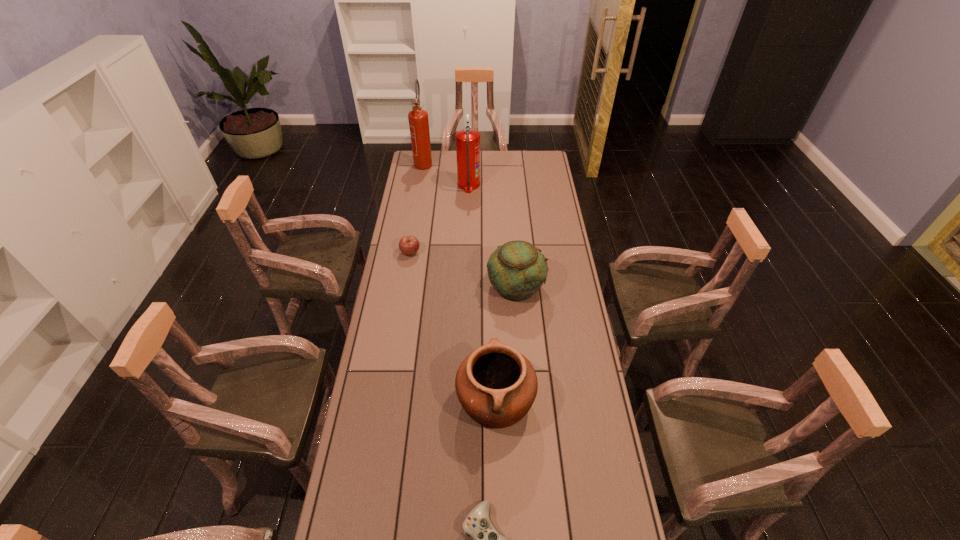
The width and height of the screenshot is (960, 540). Find the location of `free space at the far left corner of the desktop`. free space at the far left corner of the desktop is located at coordinates [x=420, y=171].

Find the location of a particular element. free point at the far right corner is located at coordinates (544, 166).

The width and height of the screenshot is (960, 540). I want to click on free space between the second nearest object and the third farthest object, so click(453, 327).

This screenshot has height=540, width=960. What are the coordinates of `vacant point located between the shorter fire extinguisher and the farthest object` in the screenshot? It's located at (446, 174).

The image size is (960, 540). Find the location of `vacant area that lies between the shorter fire extinguisher and the nearer pottery`. vacant area that lies between the shorter fire extinguisher and the nearer pottery is located at coordinates (482, 293).

The height and width of the screenshot is (540, 960). In order to click on vacant region between the fifth nearest object and the fourth farthest object in this screenshot , I will do `click(492, 235)`.

The width and height of the screenshot is (960, 540). I want to click on free spot between the fifth shortest object and the farther fire extinguisher, so click(x=446, y=174).

Where is `vacant space that's between the nearer fire extinguisher and the farther pottery`? vacant space that's between the nearer fire extinguisher and the farther pottery is located at coordinates (492, 235).

Where is `free space between the fifth tallest object and the nearer pottery`? free space between the fifth tallest object and the nearer pottery is located at coordinates (453, 327).

The image size is (960, 540). Identify the location of empty space that is in between the shorter fire extinguisher and the tallest object. coord(446,174).